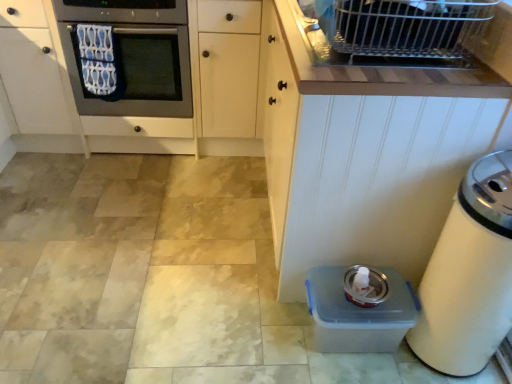
The height and width of the screenshot is (384, 512). In order to click on vacant space situated above clear plastic container at lower right (from a real-world perspective) in this screenshot , I will do `click(370, 291)`.